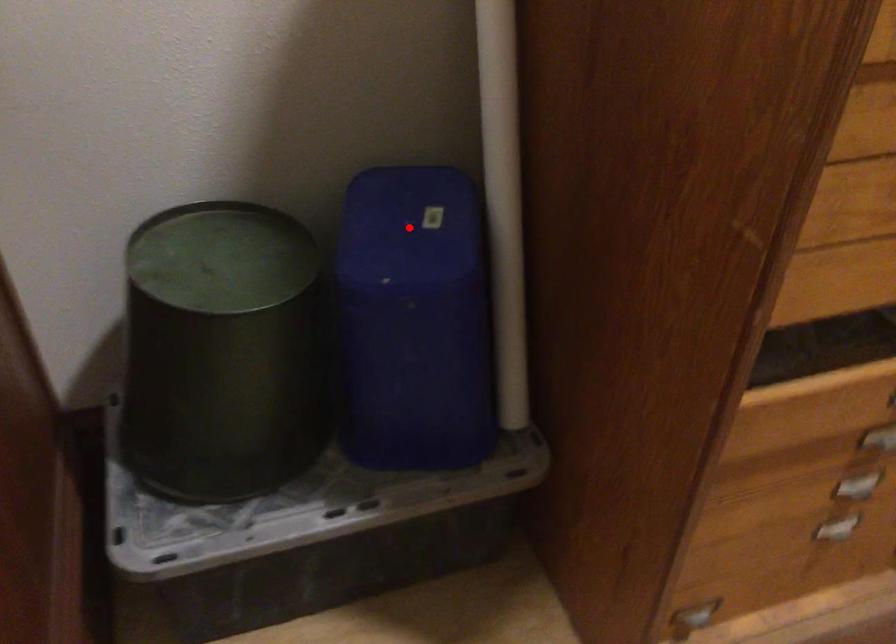
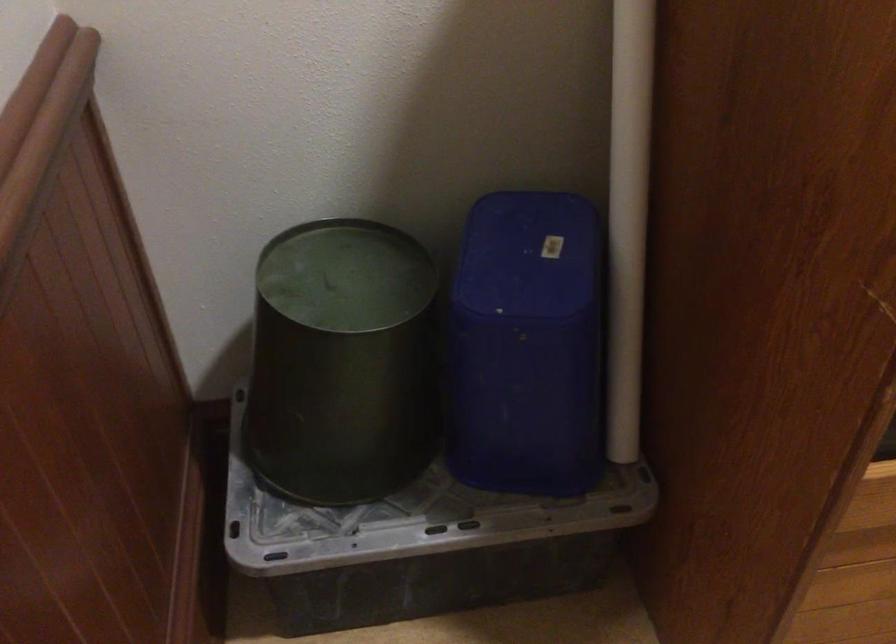
Where in the second image is the point corresponding to the highlighted location from the first image?

(529, 254)